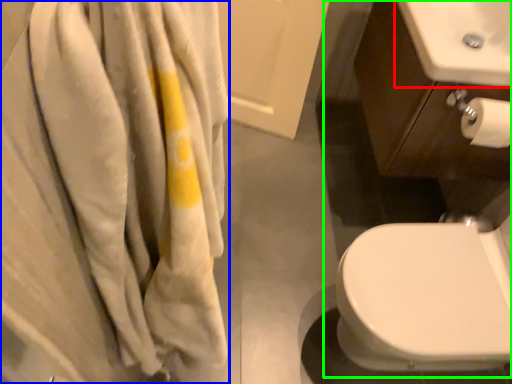
Question: Which object is the farthest from sink (highlighted by a red box)? Choose among these: bath towel (highlighted by a blue box) or sink (highlighted by a green box).

Choices:
 (A) bath towel
 (B) sink

Answer: (A)